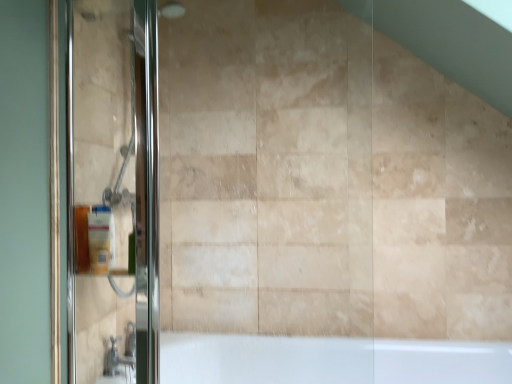
Question: Is polished glass shower door at left inside the boundaries of matte silver faucet at lower left, or outside?

Choices:
 (A) inside
 (B) outside

Answer: (B)

Question: Considering the positions of polished glass shower door at left and matte silver faucet at lower left in the image, is polished glass shower door at left taller or shorter than matte silver faucet at lower left?

Choices:
 (A) tall
 (B) short

Answer: (A)

Question: Estimate the real-world distances between objects in this image. Which object is closer to the matte plastic soap dispenser at left?

Choices:
 (A) polished glass shower door at left
 (B) matte silver faucet at lower left

Answer: (A)

Question: Which is farther from the polished glass shower door at left?

Choices:
 (A) matte plastic soap dispenser at left
 (B) matte silver faucet at lower left

Answer: (B)